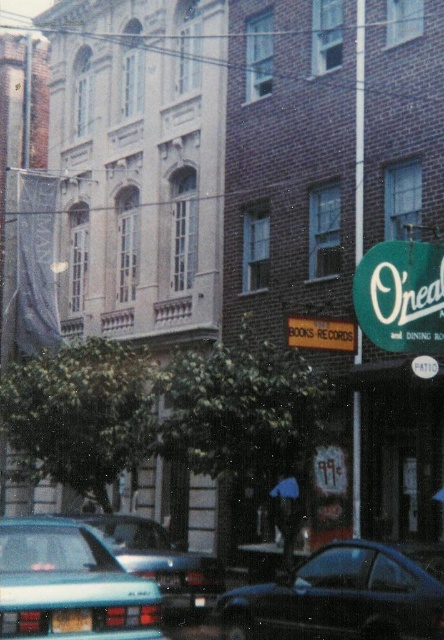
The image size is (444, 640). Describe the element at coordinates (71, 620) in the screenshot. I see `matte black license plate at lower left` at that location.

Does matte black license plate at lower left come behind yellow plastic license plate at lower center?

No, matte black license plate at lower left is in front of yellow plastic license plate at lower center.

Is point (88, 620) farther from viewer compared to point (170, 580)?

No, (88, 620) is closer to viewer.

Identify the location of matte black license plate at lower left. This screenshot has width=444, height=640. (x=71, y=620).

Is matte black sign at center below matte black license plate at lower left?

Actually, matte black sign at center is above matte black license plate at lower left.

Who is positioned more to the left, matte black sign at center or matte black license plate at lower left?

matte black license plate at lower left is more to the left.

Is point (340, 317) positioned behind point (83, 621)?

Yes, point (340, 317) is behind point (83, 621).

The height and width of the screenshot is (640, 444). What are the coordinates of `matte black sign at center` in the screenshot? It's located at (321, 333).

Is point (405, 246) behind point (142, 552)?

No, (405, 246) is closer to viewer.

The height and width of the screenshot is (640, 444). Describe the element at coordinates (401, 296) in the screenshot. I see `green fabric sign at lower right` at that location.

Where is `green fabric sign at lower right`? The width and height of the screenshot is (444, 640). green fabric sign at lower right is located at coordinates (401, 296).